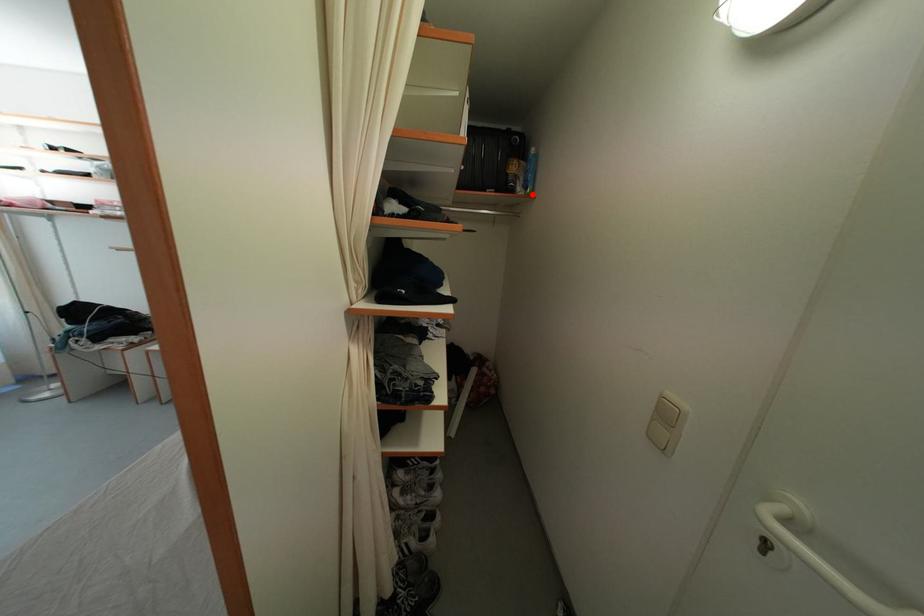
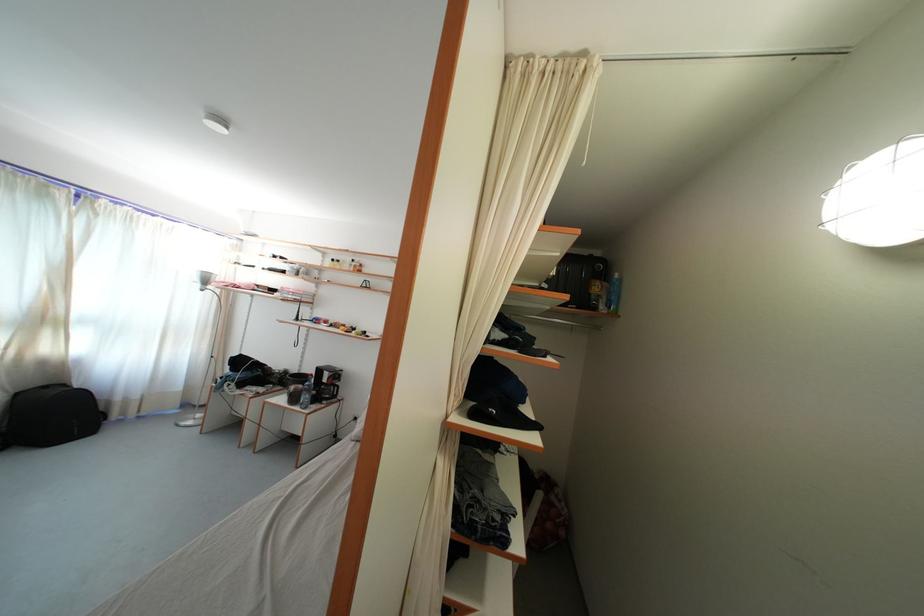
Locate, in the second image, the point that corresponds to the highlighted location in the first image.

(615, 314)